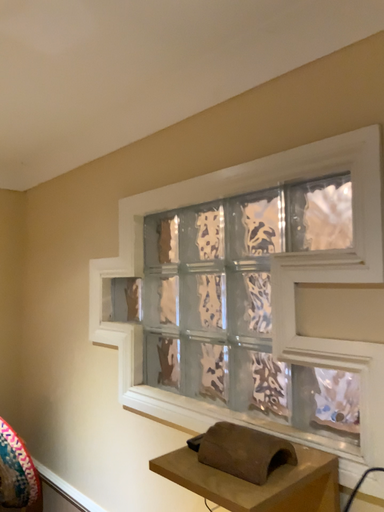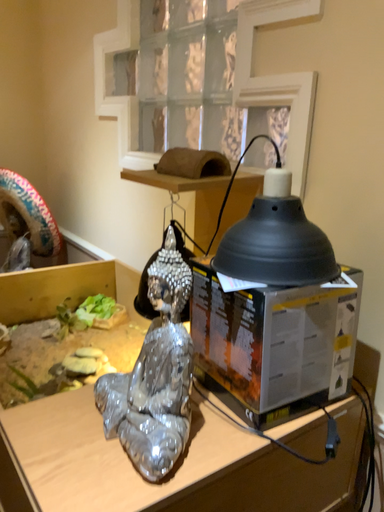
Question: How did the camera likely rotate when shooting the video?

Choices:
 (A) rotated downward
 (B) rotated upward

Answer: (A)